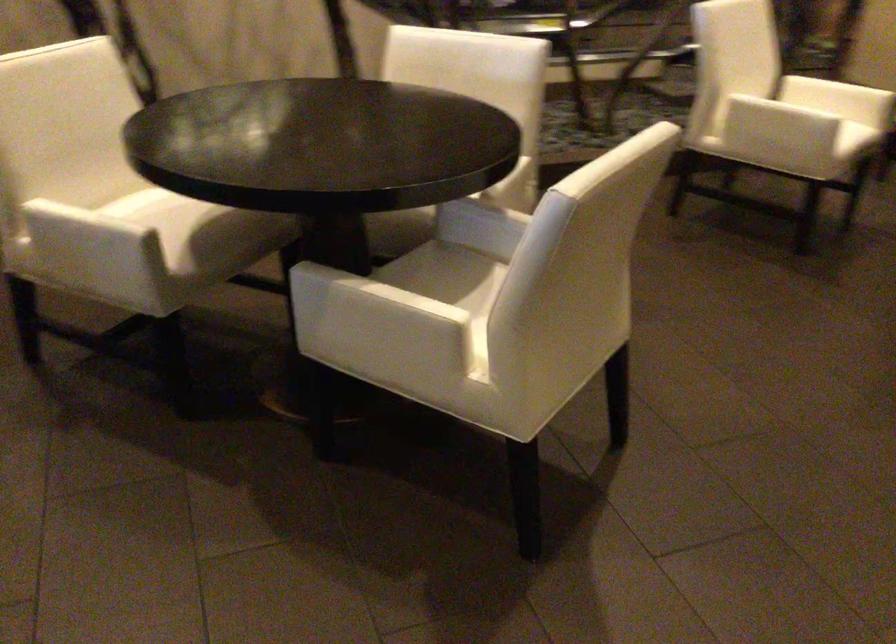
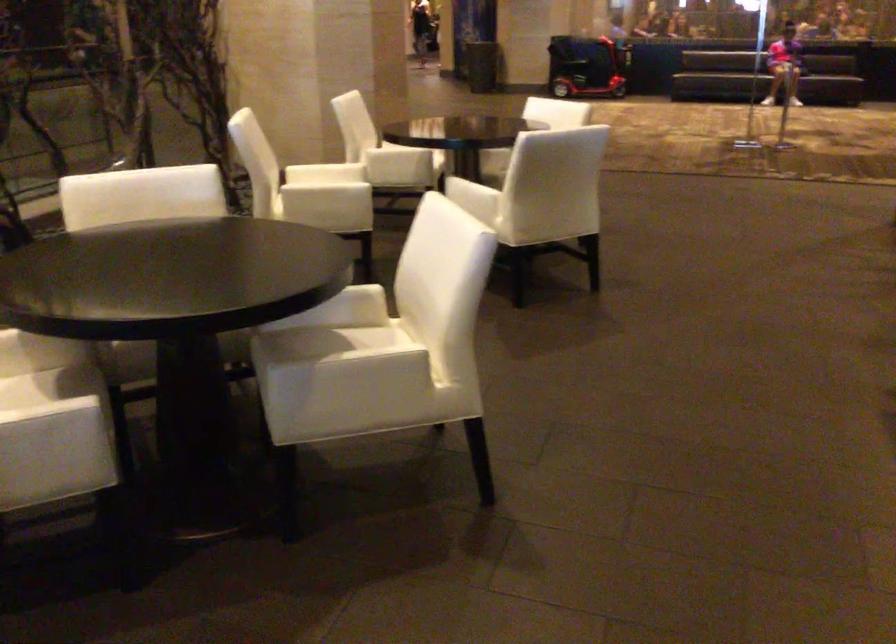
Where in the second image is the point corresponding to point (772, 126) from the first image?

(325, 199)